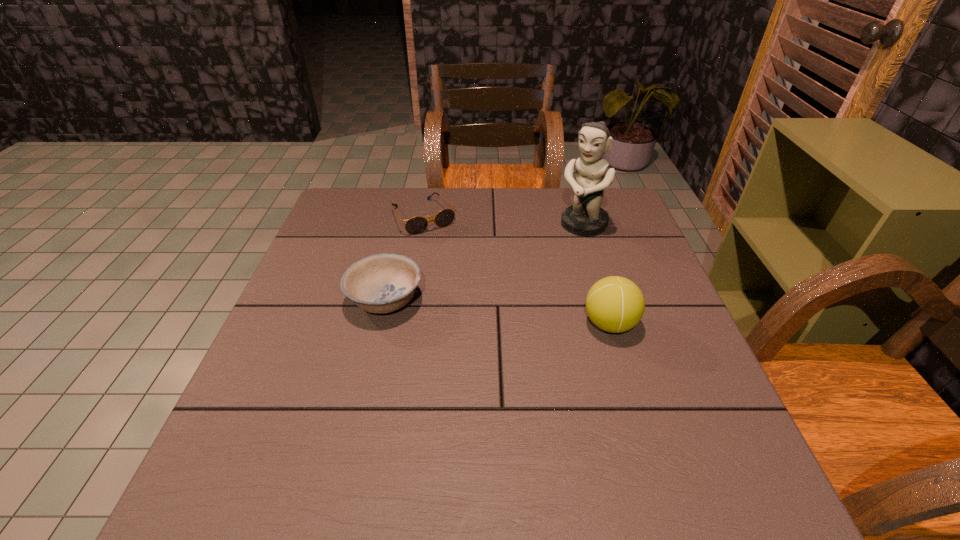
Identify the location of free region located on the front-facing side of the tallest object. The height and width of the screenshot is (540, 960). (558, 248).

At what (x,y) coordinates should I click in order to perform the action: click on vacant space located 0.090m on the front-facing side of the tallest object. Please return your answer as a coordinate pair (x, y). The height and width of the screenshot is (540, 960). Looking at the image, I should click on (554, 252).

Where is `sunglasses located at the far edge`? sunglasses located at the far edge is located at coordinates click(x=416, y=225).

Where is `figurine located in the far edge section of the desktop`? The height and width of the screenshot is (540, 960). figurine located in the far edge section of the desktop is located at coordinates (585, 217).

In order to click on object at the left edge in this screenshot , I will do `click(381, 283)`.

Locate an element on the screen. The width and height of the screenshot is (960, 540). tennis ball located at the right edge is located at coordinates (615, 304).

Image resolution: width=960 pixels, height=540 pixels. I want to click on figurine at the right edge, so click(x=585, y=217).

You are a GUI agent. You are given a task and a screenshot of the screen. Output one action in this format:
    pyautogui.click(x=<x>, y=<y>)
    Task: Click on the object present at the far right corner
    This screenshot has height=540, width=960.
    Given the screenshot: What is the action you would take?
    pyautogui.click(x=585, y=217)

At what (x,y) coordinates should I click in order to perform the action: click on free space at the far edge of the desktop. Please return your answer as a coordinate pair (x, y). Looking at the image, I should click on (529, 199).

Where is `vacant space at the near edge`? The width and height of the screenshot is (960, 540). vacant space at the near edge is located at coordinates (465, 423).